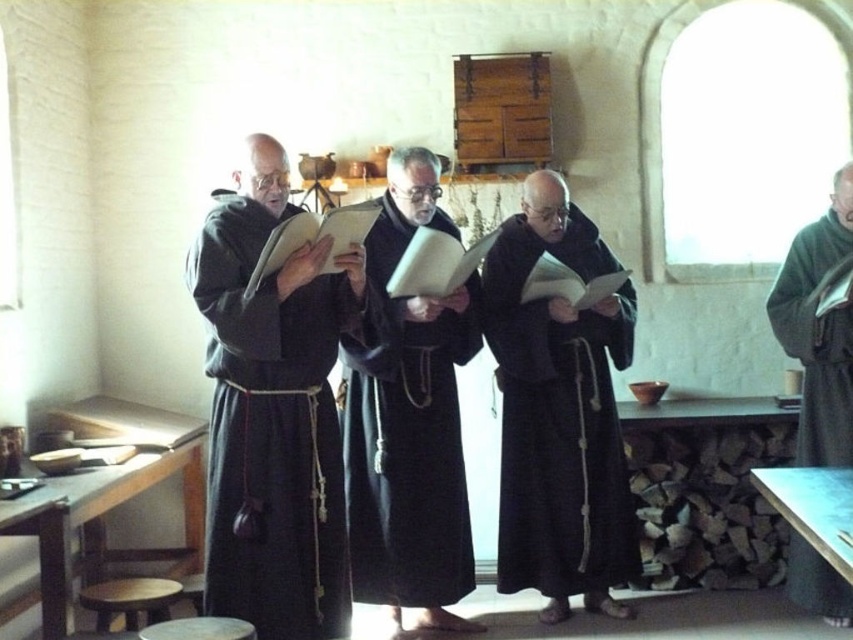
Question: Is dark matte robe at center wider than dark woolen robe at right?

Choices:
 (A) yes
 (B) no

Answer: (A)

Question: Which of these objects is positioned closest to the dark woolen robe at right?

Choices:
 (A) dark matte robe at center
 (B) black matte robe at center
 (C) black matte robe at left

Answer: (B)

Question: Which point appears farthest from the camera in this image?

Choices:
 (A) (338, 529)
 (B) (372, 508)
 (C) (848, 396)
 (D) (590, 401)

Answer: (D)

Question: Does black matte robe at left have a greater width compared to black matte robe at center?

Choices:
 (A) no
 (B) yes

Answer: (A)

Question: Does black matte robe at center lie in front of dark woolen robe at right?

Choices:
 (A) yes
 (B) no

Answer: (B)

Question: Among these points, which one is farthest from the camera?

Choices:
 (A) (833, 316)
 (B) (345, 465)
 (C) (264, 602)

Answer: (B)